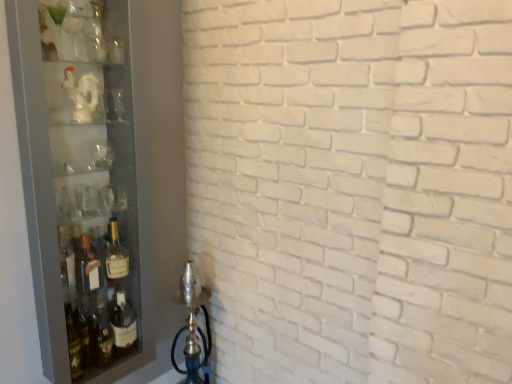
Question: Is matte glass bottle at left behind transparent glass cabinet at left?

Choices:
 (A) yes
 (B) no

Answer: (A)

Question: Is transparent glass cabinet at left located within matte glass bottle at left?

Choices:
 (A) yes
 (B) no

Answer: (B)

Question: Is matte glass bottle at left to the left of transparent glass cabinet at left from the viewer's perspective?

Choices:
 (A) yes
 (B) no

Answer: (B)

Question: Is matte glass bottle at left positioned far away from transparent glass cabinet at left?

Choices:
 (A) yes
 (B) no

Answer: (B)

Question: Could you tell me if matte glass bottle at left is turned towards transparent glass cabinet at left?

Choices:
 (A) yes
 (B) no

Answer: (A)

Question: Is point (52, 119) closer or farther from the camera than point (137, 105)?

Choices:
 (A) closer
 (B) farther

Answer: (A)

Question: Considering their positions, is white glossy statue at upper left located in front of or behind transparent glass cabinet at left?

Choices:
 (A) front
 (B) behind

Answer: (B)

Question: From a real-world perspective, is white glossy statue at upper left above or below transparent glass cabinet at left?

Choices:
 (A) below
 (B) above

Answer: (B)

Question: From their relative heights in the image, would you say white glossy statue at upper left is taller or shorter than transparent glass cabinet at left?

Choices:
 (A) short
 (B) tall

Answer: (A)

Question: Would you say white glossy statue at upper left is to the left or to the right of matte glass bottle at left in the picture?

Choices:
 (A) right
 (B) left

Answer: (B)

Question: Is point (84, 74) positioned closer to the camera than point (109, 263)?

Choices:
 (A) farther
 (B) closer

Answer: (B)

Question: From a real-world perspective, is white glossy statue at upper left above or below matte glass bottle at left?

Choices:
 (A) below
 (B) above

Answer: (B)

Question: From the image's perspective, relative to matte glass bottle at left, is white glossy statue at upper left above or below?

Choices:
 (A) below
 (B) above

Answer: (B)

Question: From the image's perspective, relative to white glossy statue at upper left, is transparent glass cabinet at left above or below?

Choices:
 (A) above
 (B) below

Answer: (B)

Question: Would you say transparent glass cabinet at left is inside or outside white glossy statue at upper left?

Choices:
 (A) outside
 (B) inside

Answer: (A)